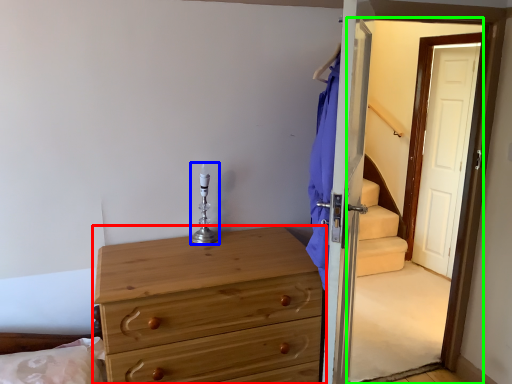
Question: Considering the real-world distances, which object is farthest from chest of drawers (highlighted by a red box)? candle holder (highlighted by a blue box) or screen door (highlighted by a green box)?

Choices:
 (A) candle holder
 (B) screen door

Answer: (B)